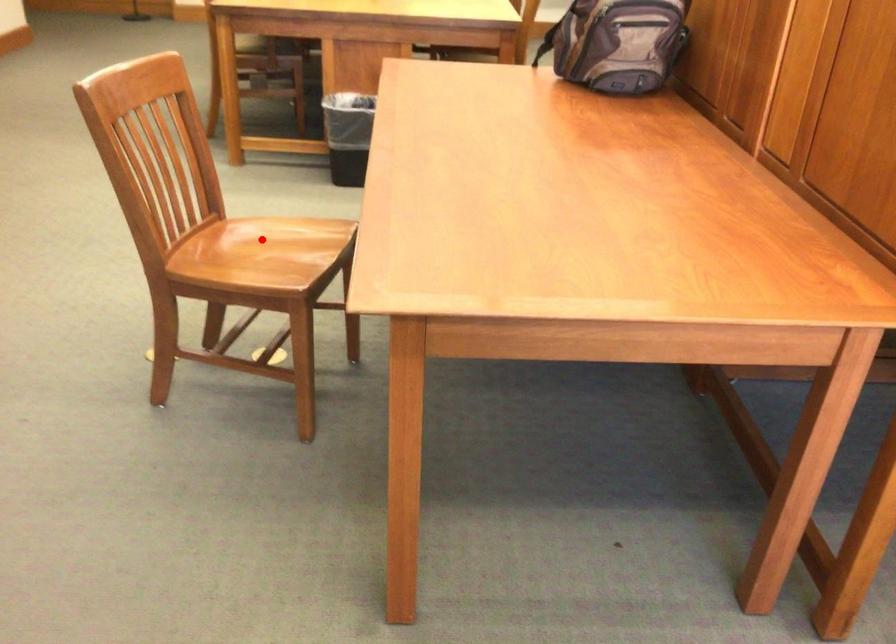
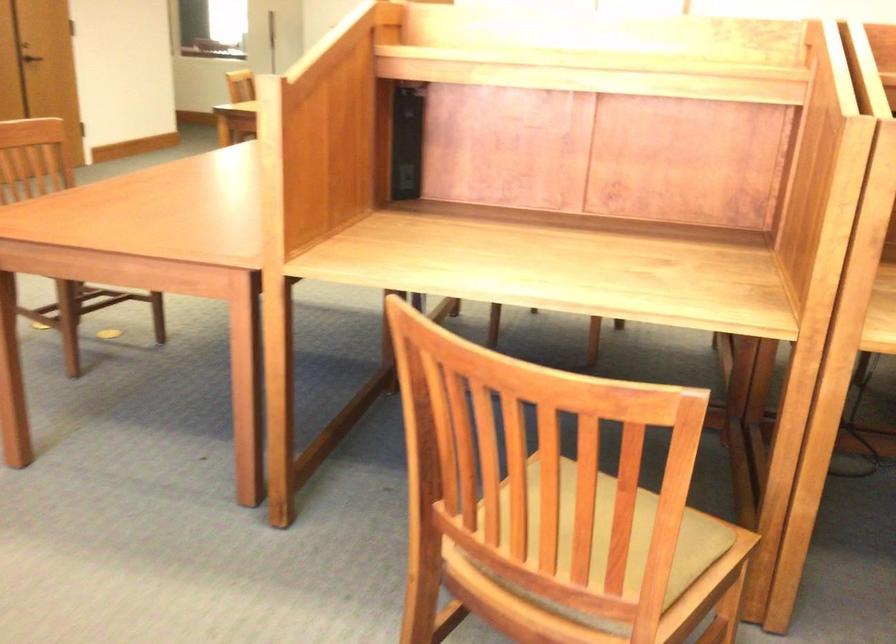
Question: I am providing you with two images of the same scene from different viewpoints. A red point is marked on the first image. Is the red point's position out of view in image 2?

Choices:
 (A) Yes
 (B) No

Answer: (A)